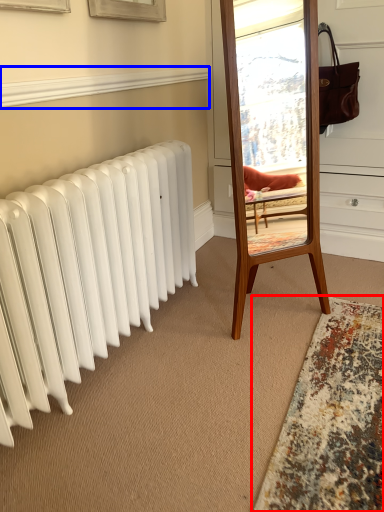
Question: Which object is further to the camera taking this photo, mat (highlighted by a red box) or window sill (highlighted by a blue box)?

Choices:
 (A) mat
 (B) window sill

Answer: (B)